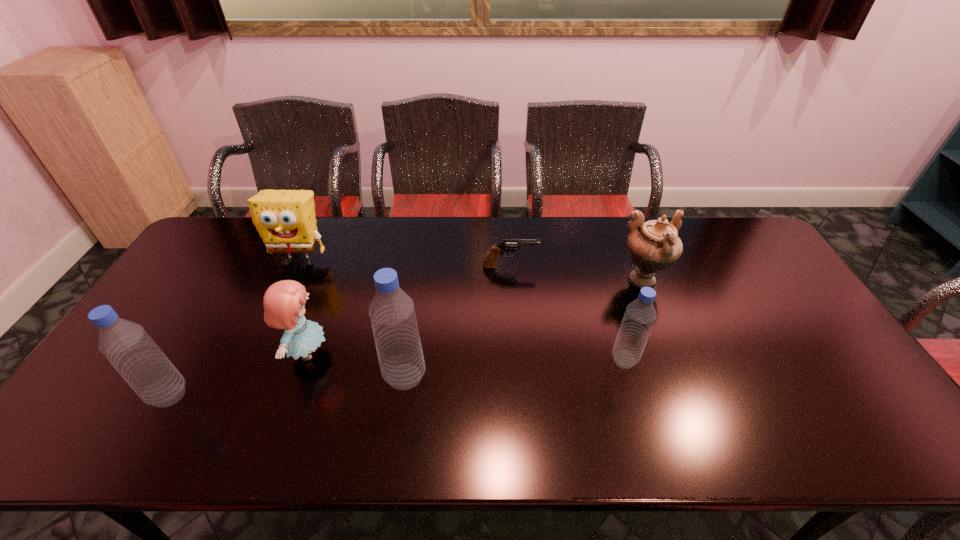
In order to click on object at the near left corner in this screenshot , I will do `click(126, 345)`.

At what (x,y) coordinates should I click in order to perform the action: click on free space at the far edge. Please return your answer as a coordinate pair (x, y). Image resolution: width=960 pixels, height=540 pixels. Looking at the image, I should click on (334, 234).

Where is `vacant space at the near edge of the desktop`? The image size is (960, 540). vacant space at the near edge of the desktop is located at coordinates (529, 400).

Locate an element on the screen. vacant region at the left edge of the desktop is located at coordinates (191, 323).

I want to click on vacant position at the right edge of the desktop, so click(776, 321).

Locate an element on the screen. This screenshot has height=540, width=960. free location at the far right corner is located at coordinates (x=734, y=241).

Locate an element on the screen. The height and width of the screenshot is (540, 960). vacant area between the doll and the fourth object from right to left is located at coordinates (356, 364).

You are a GUI agent. You are given a task and a screenshot of the screen. Output one action in this format:
    pyautogui.click(x=<x>, y=<y>)
    Task: Click on the vacant region between the rightmost object and the second bottle from left to right
    Image resolution: width=960 pixels, height=540 pixels.
    Given the screenshot: What is the action you would take?
    pyautogui.click(x=523, y=329)

Identify the location of vacant point located between the shortest bottle and the doll. The width and height of the screenshot is (960, 540). (466, 356).

Locate an element on the screen. This screenshot has width=960, height=540. blank region between the fourth object from left to right and the sponge is located at coordinates (352, 319).